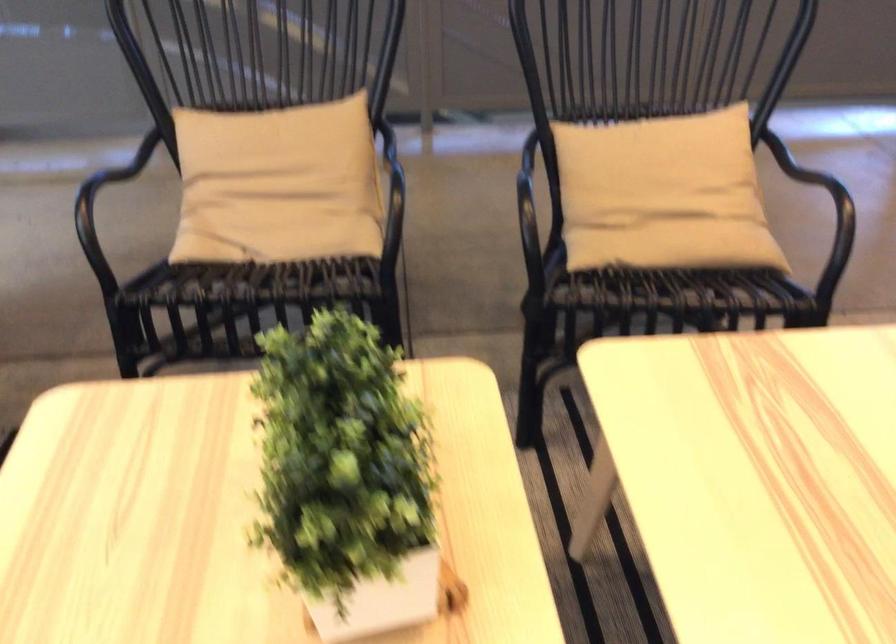
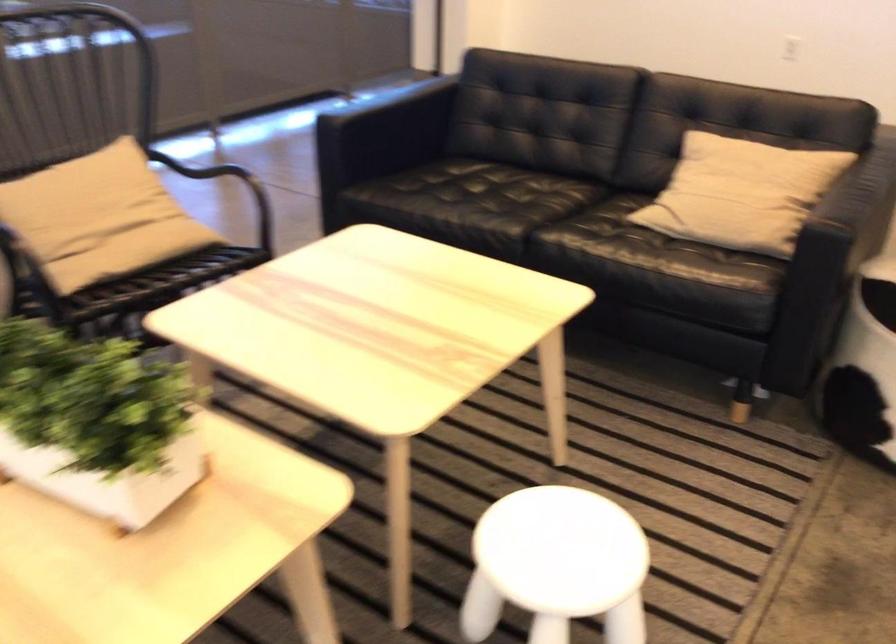
In the second image, find the point that corresponds to point 695,250 in the first image.

(151, 254)